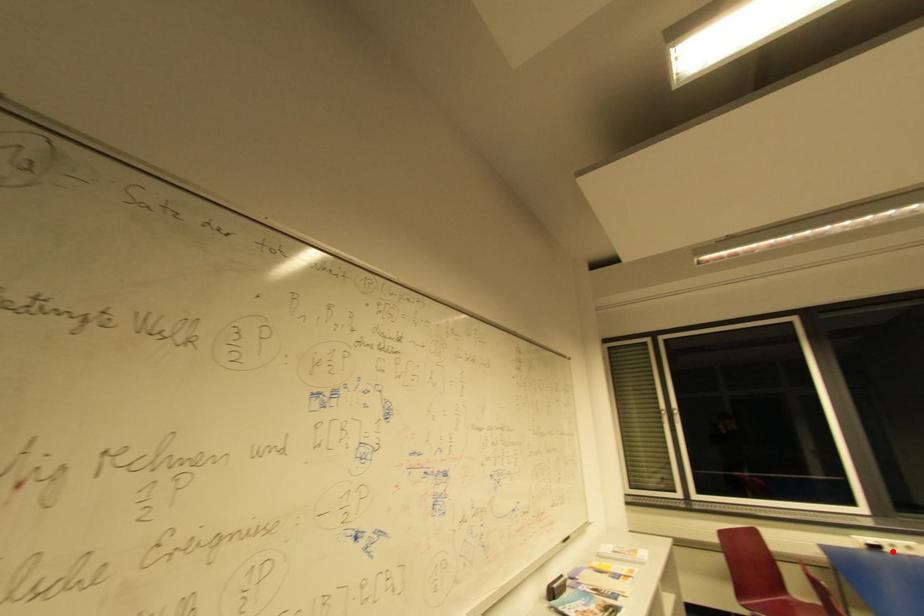
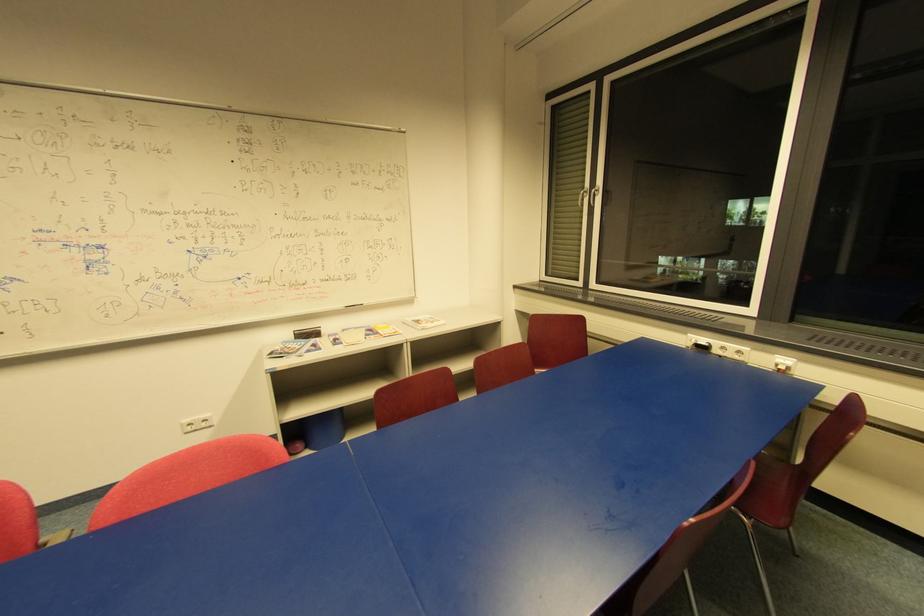
Question: A red point is marked in image1. In image2, is the corresponding 3D point closer to the camera or farther? Reply with the corresponding letter.

Choices:
 (A) The corresponding 3D point is closer.
 (B) The corresponding 3D point is farther.

Answer: (B)